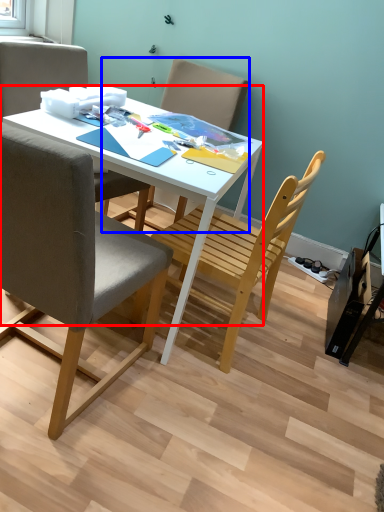
Question: Which of the following is the farthest to the observer, desk (highlighted by a red box) or chair (highlighted by a blue box)?

Choices:
 (A) desk
 (B) chair

Answer: (B)